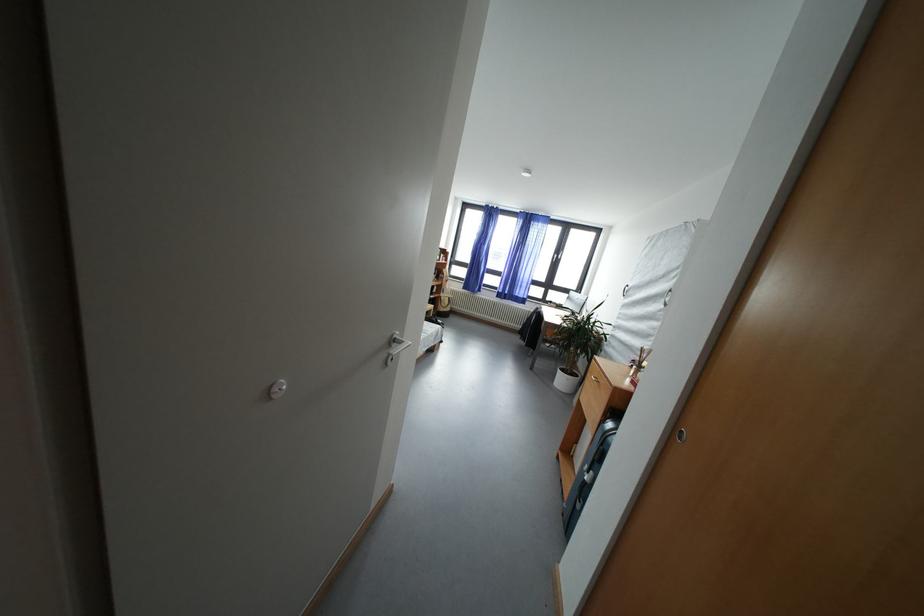
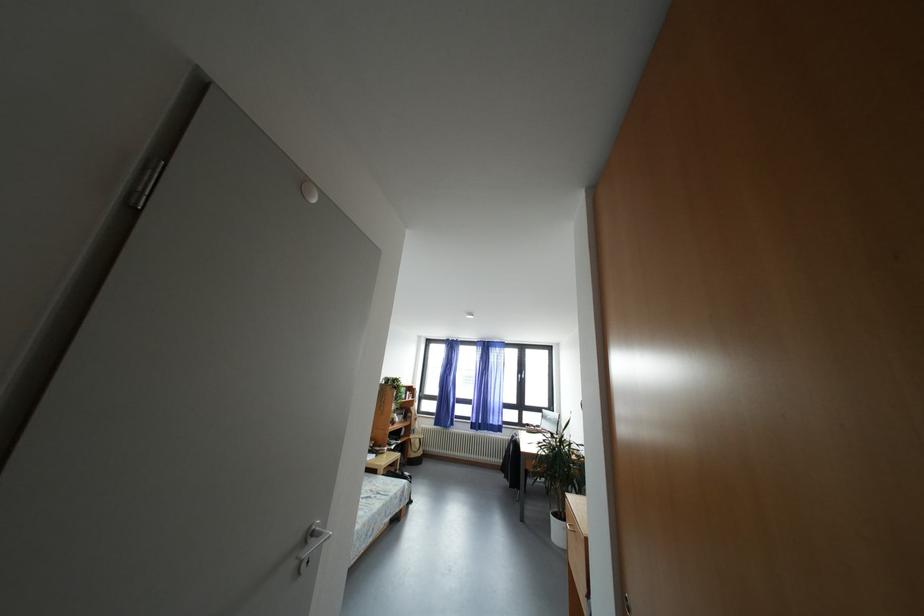
Find the pixel in the second image that matches (557,307) in the first image.

(533, 430)